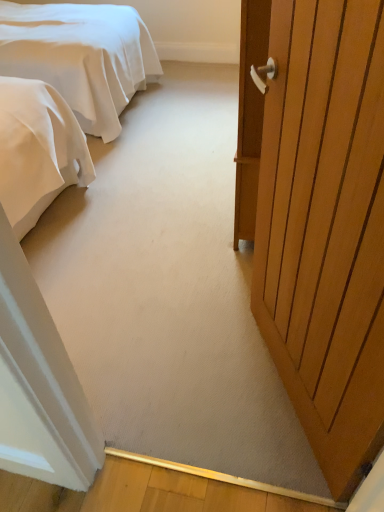
Question: Does point pos(84,95) appear closer or farther from the camera than point pos(369,422)?

Choices:
 (A) closer
 (B) farther

Answer: (B)

Question: Is white satin bed at upper left inside the boundaries of wooden door at right, or outside?

Choices:
 (A) outside
 (B) inside

Answer: (A)

Question: Looking at the image, does white satin bed at upper left seem bigger or smaller compared to wooden door at right?

Choices:
 (A) small
 (B) big

Answer: (B)

Question: Would you say wooden door at right is to the left or to the right of white satin bed at upper left in the picture?

Choices:
 (A) left
 (B) right

Answer: (B)

Question: From the image's perspective, is wooden door at right located above or below white satin bed at upper left?

Choices:
 (A) below
 (B) above

Answer: (A)

Question: Is wooden door at right bigger or smaller than white satin bed at upper left?

Choices:
 (A) small
 (B) big

Answer: (A)

Question: Is wooden door at right taller or shorter than white satin bed at upper left?

Choices:
 (A) tall
 (B) short

Answer: (A)